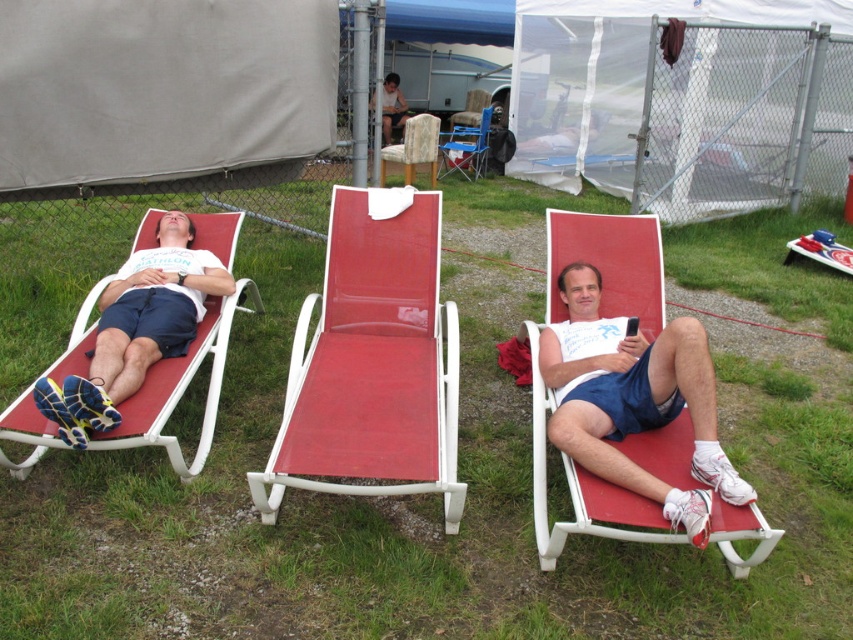
Question: Estimate the real-world distances between objects in this image. Which object is farther from the red mesh beach chair at center?

Choices:
 (A) metallic folding chair at center
 (B) wooden textured chair at center
 (C) matte red lounge chair at left

Answer: (A)

Question: Can you confirm if red mesh beach chair at center is positioned to the left of wooden textured chair at center?

Choices:
 (A) no
 (B) yes

Answer: (A)

Question: Among these objects, which one is nearest to the camera?

Choices:
 (A) wooden textured chair at center
 (B) red mesh beach chair at center

Answer: (B)

Question: Is matte red lounge chair at left positioned behind metallic folding chair at center?

Choices:
 (A) no
 (B) yes

Answer: (A)

Question: Which of these objects is positioned closest to the red mesh beach chair at center?

Choices:
 (A) green grass at center
 (B) matte red lounge chair at left
 (C) metallic folding chair at center

Answer: (B)

Question: Does green grass at center have a greater width compared to wooden textured chair at center?

Choices:
 (A) no
 (B) yes

Answer: (B)